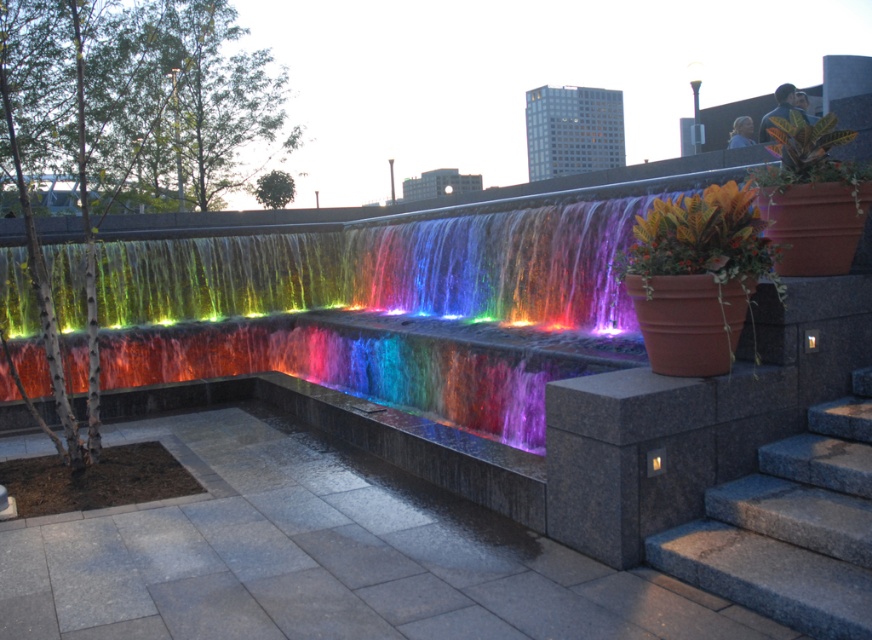
Does granite steps at lower right have a greater height compared to terracotta pot at right?

In fact, granite steps at lower right may be shorter than terracotta pot at right.

Consider the image. Does granite steps at lower right have a lesser height compared to terracotta pot at right?

Correct, granite steps at lower right is not as tall as terracotta pot at right.

Image resolution: width=872 pixels, height=640 pixels. Describe the element at coordinates (791, 525) in the screenshot. I see `granite steps at lower right` at that location.

Image resolution: width=872 pixels, height=640 pixels. I want to click on granite steps at lower right, so click(x=791, y=525).

Locate an element on the screen. This screenshot has width=872, height=640. granite steps at lower right is located at coordinates pyautogui.click(x=791, y=525).

Consider the image. Can you confirm if granite steps at lower right is positioned to the right of green glossy leafy plant at upper right?

Incorrect, granite steps at lower right is not on the right side of green glossy leafy plant at upper right.

Between point (835, 512) and point (789, 134), which one is positioned in front?

Point (835, 512) is in front.

Locate an element on the screen. The height and width of the screenshot is (640, 872). granite steps at lower right is located at coordinates (791, 525).

Image resolution: width=872 pixels, height=640 pixels. What are the coordinates of `terracotta pot at right` in the screenshot? It's located at (696, 276).

Is terracotta pot at right to the left of green glossy leafy plant at upper right from the viewer's perspective?

Correct, you'll find terracotta pot at right to the left of green glossy leafy plant at upper right.

What do you see at coordinates (696, 276) in the screenshot? I see `terracotta pot at right` at bounding box center [696, 276].

Identify the location of terracotta pot at right. This screenshot has width=872, height=640. (696, 276).